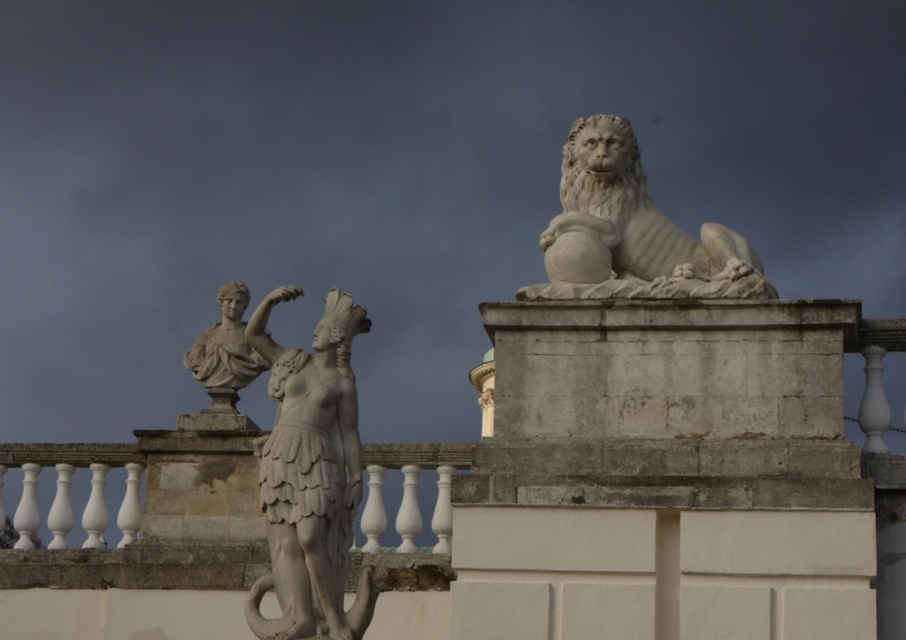
You are standing in the classical architectural setting shown in the image. There is a point marked at coordinates (310, 477). Which object in the scene does this point belong to?

The point at coordinates (310, 477) is on the white stone statue at center.

You are an art student analyzing the composition of the classical scene. You notice the white stone statue at center and the white stone lion at upper right. Which of these two statues is located to the left of the other?

The white stone statue at center is positioned on the left side of white stone lion at upper right.